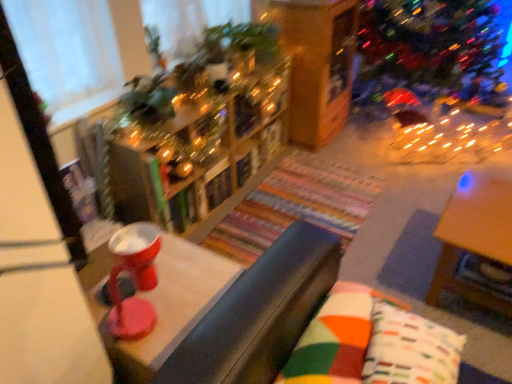
Question: In which direction should I rotate to look at multicolored fabric pillow at center, which is the second pillow in right-to-left order?

Choices:
 (A) left
 (B) right

Answer: (B)

Question: Is multicolored fabric pillow at center, which is the second pillow in right-to-left order, positioned far away from multicolored fabric pillow at lower right, acting as the first pillow starting from the right?

Choices:
 (A) yes
 (B) no

Answer: (B)

Question: Is multicolored fabric pillow at center, the 1th pillow positioned from the left, wider than multicolored fabric pillow at lower right, acting as the first pillow starting from the right?

Choices:
 (A) no
 (B) yes

Answer: (A)

Question: Considering the relative sizes of multicolored fabric pillow at center, the 1th pillow positioned from the left, and multicolored fabric pillow at lower right, acting as the first pillow starting from the right, in the image provided, is multicolored fabric pillow at center, the 1th pillow positioned from the left, thinner than multicolored fabric pillow at lower right, acting as the first pillow starting from the right,?

Choices:
 (A) yes
 (B) no

Answer: (A)

Question: Considering the relative sizes of multicolored fabric pillow at center, which is the second pillow in right-to-left order, and multicolored fabric pillow at lower right, acting as the first pillow starting from the right, in the image provided, is multicolored fabric pillow at center, which is the second pillow in right-to-left order, bigger than multicolored fabric pillow at lower right, acting as the first pillow starting from the right,?

Choices:
 (A) yes
 (B) no

Answer: (A)

Question: Is multicolored fabric pillow at center, which is the second pillow in right-to-left order, surrounding multicolored fabric pillow at lower right, which ranks as the 2th pillow in left-to-right order?

Choices:
 (A) yes
 (B) no

Answer: (B)

Question: From the image's perspective, would you say multicolored fabric pillow at center, which is the second pillow in right-to-left order, is shown under multicolored fabric pillow at lower right, acting as the first pillow starting from the right?

Choices:
 (A) no
 (B) yes

Answer: (A)

Question: Is the position of multicolored fabric pillow at lower right, acting as the first pillow starting from the right, less distant than that of shiny plastic bowl at center, the 2th table in the right-to-left sequence?

Choices:
 (A) yes
 (B) no

Answer: (A)

Question: Is multicolored fabric pillow at lower right, which ranks as the 2th pillow in left-to-right order, facing towards shiny plastic bowl at center, the 2th table in the right-to-left sequence?

Choices:
 (A) no
 (B) yes

Answer: (A)

Question: From the image's perspective, is multicolored fabric pillow at lower right, acting as the first pillow starting from the right, beneath shiny plastic bowl at center, the 2th table in the right-to-left sequence?

Choices:
 (A) no
 (B) yes

Answer: (A)

Question: Considering the relative sizes of multicolored fabric pillow at lower right, which ranks as the 2th pillow in left-to-right order, and shiny plastic bowl at center, the 1th table when ordered from left to right, in the image provided, is multicolored fabric pillow at lower right, which ranks as the 2th pillow in left-to-right order, bigger than shiny plastic bowl at center, the 1th table when ordered from left to right,?

Choices:
 (A) yes
 (B) no

Answer: (B)

Question: From the image's perspective, would you say multicolored fabric pillow at lower right, which ranks as the 2th pillow in left-to-right order, is positioned over shiny plastic bowl at center, the 1th table when ordered from left to right?

Choices:
 (A) no
 (B) yes

Answer: (B)

Question: Is shiny plastic bowl at center, the 1th table when ordered from left to right, at the back of multicolored fabric pillow at lower right, which ranks as the 2th pillow in left-to-right order?

Choices:
 (A) no
 (B) yes

Answer: (B)

Question: Can you confirm if shiny plastic bowl at center, the 1th table when ordered from left to right, is shorter than wooden table at right, the 1th table when ordered from right to left?

Choices:
 (A) yes
 (B) no

Answer: (B)